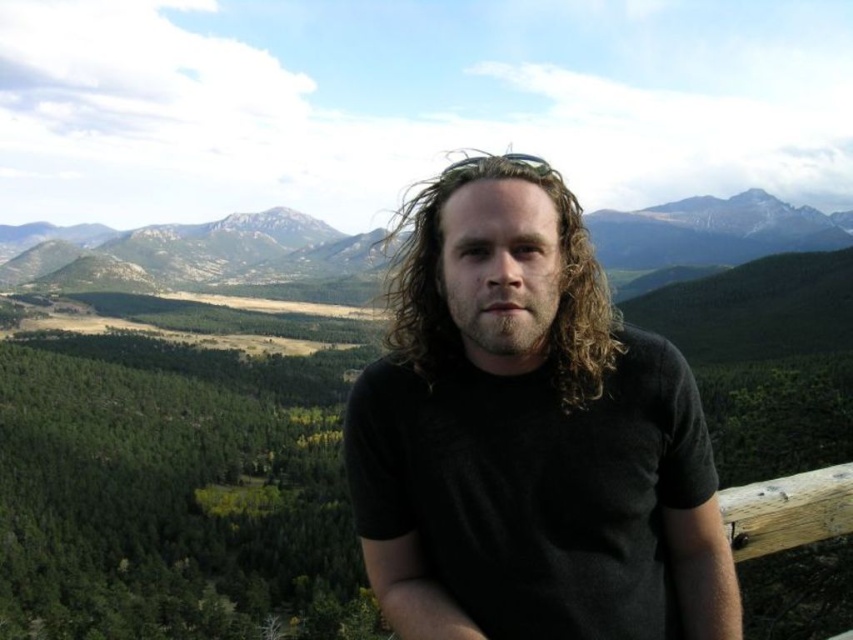
You are a hiker trying to locate the green forested mountains at upper center. According to the coordinates provided, where should you look in the image?

The green forested mountains at upper center are located at coordinates point (175, 483).

You are a photographer trying to capture the person in the scene. The person has curly blonde hair at center and brown fuzzy beard at center. Which part of their face is more on the right side?

The curly blonde hair at center is more on the right side of the person compared to the brown fuzzy beard at center.

You are a photographer trying to capture the person at the overlook. The curly blonde hair at center and brown fuzzy beard at center are both visible. Which of these two features is more prominent in the photo?

The curly blonde hair at center is larger in size than the brown fuzzy beard at center, making it more prominent in the photo.